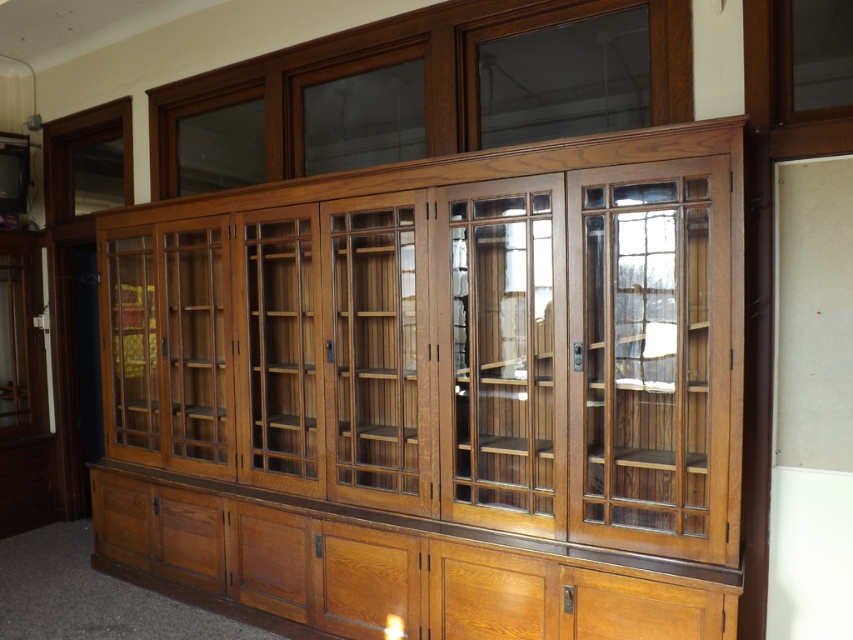
You are organizing books on a shelf in the library and need to place a large dictionary. You see the clear glass cabinet at center and the clear wood glass door at center. Which object should you avoid placing the dictionary on to ensure it doesn t fall off?

You should avoid placing the dictionary on the clear glass cabinet at center because it occupies less space than the clear wood glass door at center, making it less stable for heavy items.

From the picture: You are organizing books in a library and need to place a tall book on a shelf. You see the clear glass cabinet at center and the clear wood glass door at center. Which object should you place the tall book on to ensure it fits?

The clear glass cabinet at center is taller than the clear wood glass door at center, so you should place the tall book on the clear glass cabinet at center to ensure it fits.

You are standing in front of the bookcase and want to reach the clear wood glass door at center. Is the clear glass cabinet at center blocking your direct path to it?

The clear glass cabinet at center is further to the viewer than clear wood glass door at center, so the clear glass cabinet at center is in front of the clear wood glass door at center and would block your path.